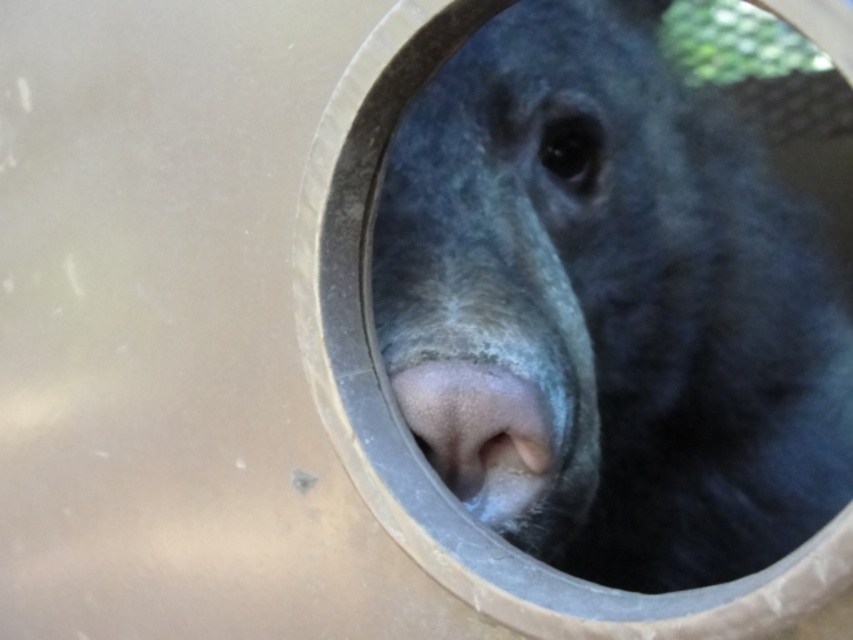
Is fuzzy black bear at center shorter than gray matte nose at center?

In fact, fuzzy black bear at center may be taller than gray matte nose at center.

Who is taller, fuzzy black bear at center or gray matte nose at center?

fuzzy black bear at center is taller.

At what (x,y) coordinates should I click in order to perform the action: click on fuzzy black bear at center. Please return your answer as a coordinate pair (x, y). Looking at the image, I should click on pos(608,307).

Image resolution: width=853 pixels, height=640 pixels. I want to click on fuzzy black bear at center, so click(x=608, y=307).